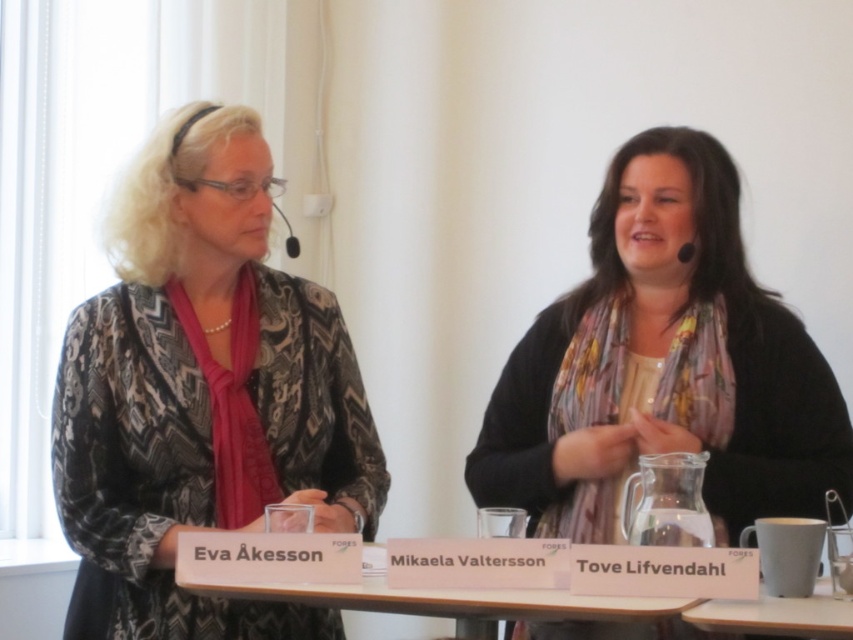
You are a photographer at a formal event and need to position a camera so that both the patterned fabric jacket at left and the white paperboard at center are in frame. Based on their heights, which object should be placed closer to the camera to ensure both are fully visible?

The patterned fabric jacket at left is taller than the white paperboard at center. To ensure both are fully visible, the taller object, the patterned fabric jacket at left, should be placed closer to the camera so that the camera can capture its full height without cropping the top, while the shorter white paperboard at center can be positioned slightly farther back.